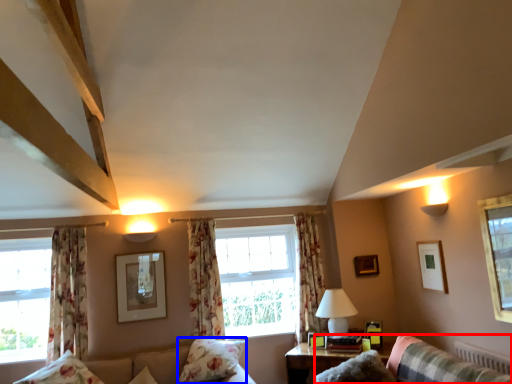
Question: Which object appears farthest to the camera in this image, couch (highlighted by a red box) or pillow (highlighted by a blue box)?

Choices:
 (A) couch
 (B) pillow

Answer: (B)